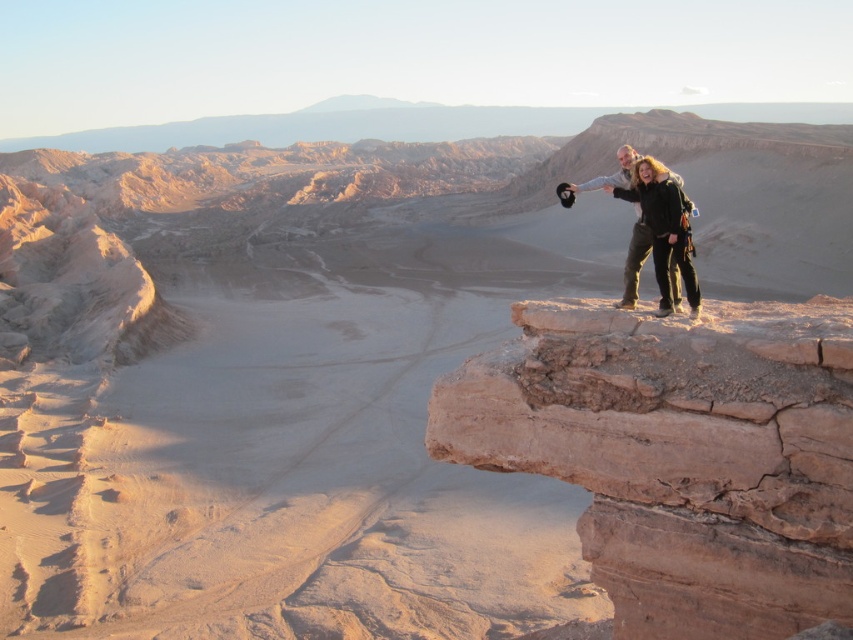
You are a photographer standing at the camera position in the desert scene. You want to capture a closeup shot of the brown rocky cliff at upper right. Considering the distance, do you think you can reach it on foot within 3 minutes if you walk at a normal pace of 3 miles per hour?

The brown rocky cliff at upper right is 74.25 feet away from the camera. Walking at a normal pace of 3 mph, it would take approximately 0.5 minutes to reach it, so yes, you can easily reach it within 3 minutes.

You are standing at the center of the desert scene and want to locate the brown rocky cliff at upper right. Based on the coordinates provided, in which direction should you look to find it?

The brown rocky cliff at upper right is located at coordinates point (680,454), which corresponds to the upper right direction from your current position at the center of the desert scene.

You are a hiker who wants to take a photo of the brown rocky cliff at upper right and the dark green pants at right. Which object should you focus on first if you want to capture both in a single frame without moving the camera?

You should focus on the dark green pants at right first because the brown rocky cliff at upper right is positioned under it, so adjusting focus to the pants will ensure both are in the frame.